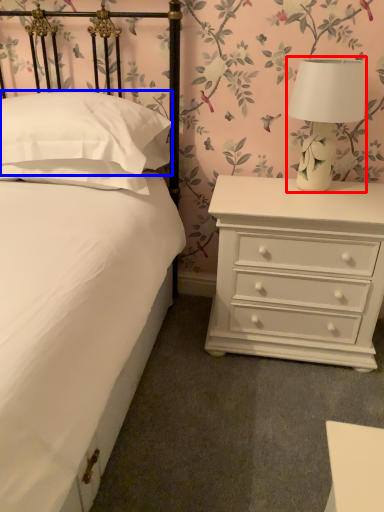
Question: Which object appears farthest to the camera in this image, table lamp (highlighted by a red box) or pillow (highlighted by a blue box)?

Choices:
 (A) table lamp
 (B) pillow

Answer: (A)